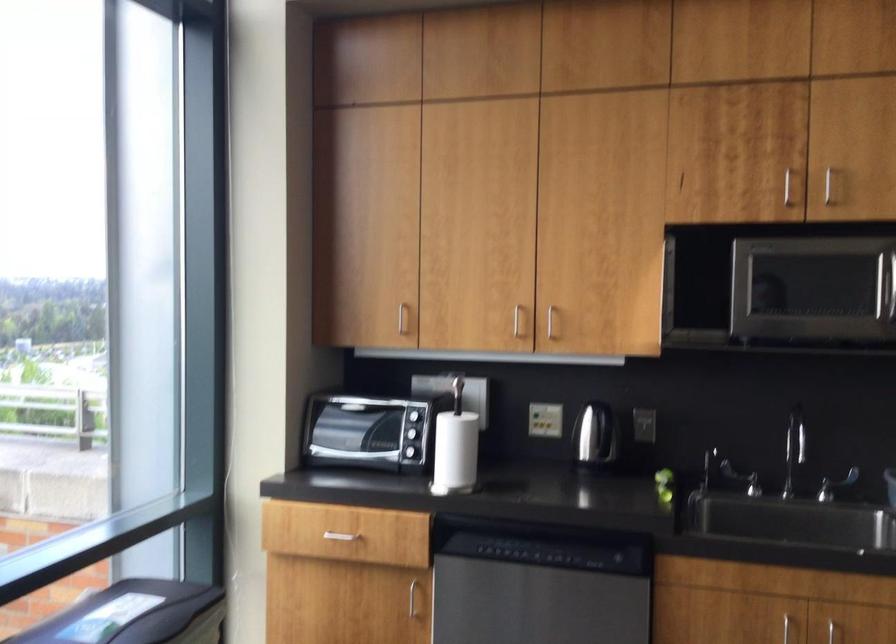
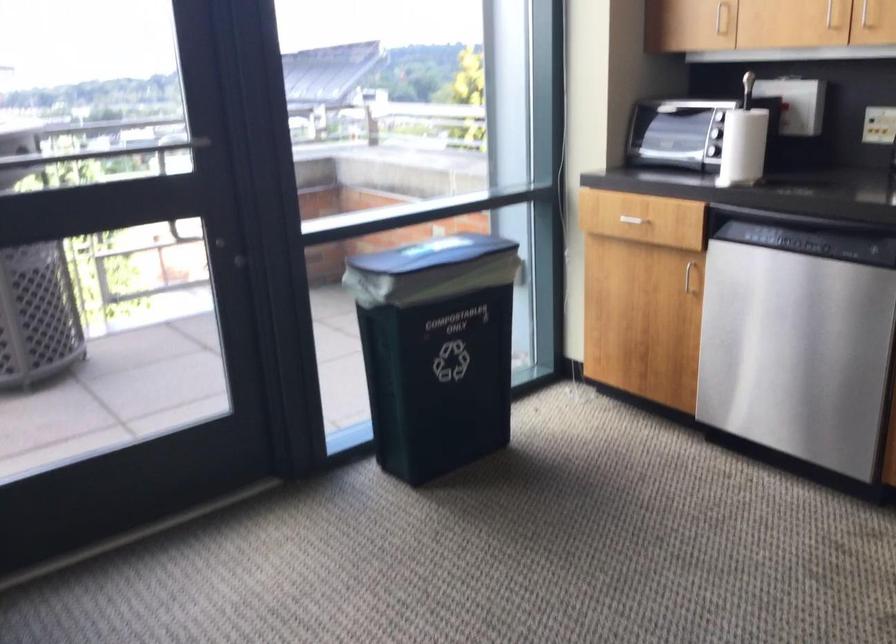
Find the pixel in the second image that matches pixel 337 529 in the first image.

(633, 214)